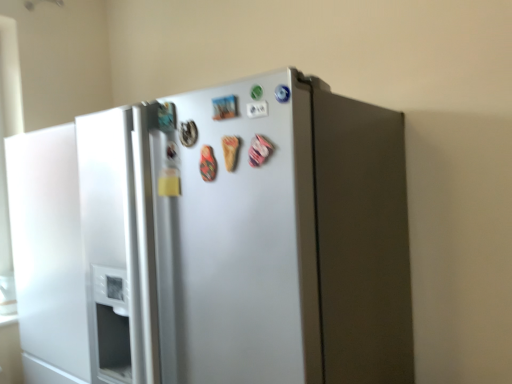
What do you see at coordinates (215, 240) in the screenshot? I see `satin silver refrigerator at center` at bounding box center [215, 240].

In order to face satin silver refrigerator at center, should I rotate leftwards or rightwards?

Rotate left and turn 2.262 degrees.

This screenshot has height=384, width=512. Find the location of `satin silver refrigerator at center`. satin silver refrigerator at center is located at coordinates (215, 240).

This screenshot has height=384, width=512. In order to click on white matte refrigerator door at left in this screenshot , I will do `click(48, 254)`.

What do you see at coordinates (48, 254) in the screenshot? This screenshot has height=384, width=512. I see `white matte refrigerator door at left` at bounding box center [48, 254].

Find the location of a particular element. The height and width of the screenshot is (384, 512). satin silver refrigerator at center is located at coordinates (215, 240).

Is white matte refrigerator door at left at the right side of satin silver refrigerator at center?

No.

Does white matte refrigerator door at left lie in front of satin silver refrigerator at center?

No, white matte refrigerator door at left is further to the viewer.

Does point (83, 311) come behind point (244, 134)?

Yes.

From the image's perspective, is white matte refrigerator door at left positioned above or below satin silver refrigerator at center?

white matte refrigerator door at left is situated lower than satin silver refrigerator at center in the image.

From a real-world perspective, does white matte refrigerator door at left stand above satin silver refrigerator at center?

No, from a real-world perspective, white matte refrigerator door at left is not over satin silver refrigerator at center

In terms of width, does white matte refrigerator door at left look wider or thinner when compared to satin silver refrigerator at center?

Considering their sizes, white matte refrigerator door at left looks slimmer than satin silver refrigerator at center.

Is white matte refrigerator door at left shorter than satin silver refrigerator at center?

Indeed, white matte refrigerator door at left has a lesser height compared to satin silver refrigerator at center.

Which of these two, white matte refrigerator door at left or satin silver refrigerator at center, is smaller?

white matte refrigerator door at left is smaller.

Would you say white matte refrigerator door at left contains satin silver refrigerator at center?

Actually, satin silver refrigerator at center is outside white matte refrigerator door at left.

Is white matte refrigerator door at left touching satin silver refrigerator at center?

No, white matte refrigerator door at left is not beside satin silver refrigerator at center.

Is white matte refrigerator door at left facing towards satin silver refrigerator at center?

No, white matte refrigerator door at left is not oriented towards satin silver refrigerator at center.

How different are the orientations of white matte refrigerator door at left and satin silver refrigerator at center in degrees?

0.000165 degrees.

How much distance is there between white matte refrigerator door at left and satin silver refrigerator at center?

The distance of white matte refrigerator door at left from satin silver refrigerator at center is 12.44 inches.

Where is `refrigerator above the white matte refrigerator door at left (from a real-world perspective)`? The height and width of the screenshot is (384, 512). refrigerator above the white matte refrigerator door at left (from a real-world perspective) is located at coordinates (215, 240).

Which object is positioned more to the left, satin silver refrigerator at center or white matte refrigerator door at left?

Positioned to the left is white matte refrigerator door at left.

Is satin silver refrigerator at center further to the viewer compared to white matte refrigerator door at left?

No, it is not.

Is point (282, 336) closer to viewer compared to point (33, 248)?

Yes, point (282, 336) is closer to viewer.

From the image's perspective, between satin silver refrigerator at center and white matte refrigerator door at left, which one is located above?

satin silver refrigerator at center is shown above in the image.

From a real-world perspective, who is located higher, satin silver refrigerator at center or white matte refrigerator door at left?

satin silver refrigerator at center is physically above.

Which object is wider, satin silver refrigerator at center or white matte refrigerator door at left?

satin silver refrigerator at center.

Is satin silver refrigerator at center taller or shorter than white matte refrigerator door at left?

Clearly, satin silver refrigerator at center is taller compared to white matte refrigerator door at left.

Does satin silver refrigerator at center have a larger size compared to white matte refrigerator door at left?

Yes, satin silver refrigerator at center is bigger than white matte refrigerator door at left.

Is satin silver refrigerator at center situated inside white matte refrigerator door at left or outside?

satin silver refrigerator at center cannot be found inside white matte refrigerator door at left.

Is satin silver refrigerator at center placed right next to white matte refrigerator door at left?

satin silver refrigerator at center is not next to white matte refrigerator door at left, and they're not touching.

Is satin silver refrigerator at center turned away from white matte refrigerator door at left?

No.

Can you tell me how much satin silver refrigerator at center and white matte refrigerator door at left differ in facing direction?

satin silver refrigerator at center and white matte refrigerator door at left are facing 0.000165 degrees away from each other.

Image resolution: width=512 pixels, height=384 pixels. I want to click on door located behind the satin silver refrigerator at center, so click(x=48, y=254).

There is a white matte refrigerator door at left. Where is `refrigerator above it (from a real-world perspective)`? This screenshot has width=512, height=384. refrigerator above it (from a real-world perspective) is located at coordinates (215, 240).

Locate an element on the screen. The image size is (512, 384). door below the satin silver refrigerator at center (from a real-world perspective) is located at coordinates (48, 254).